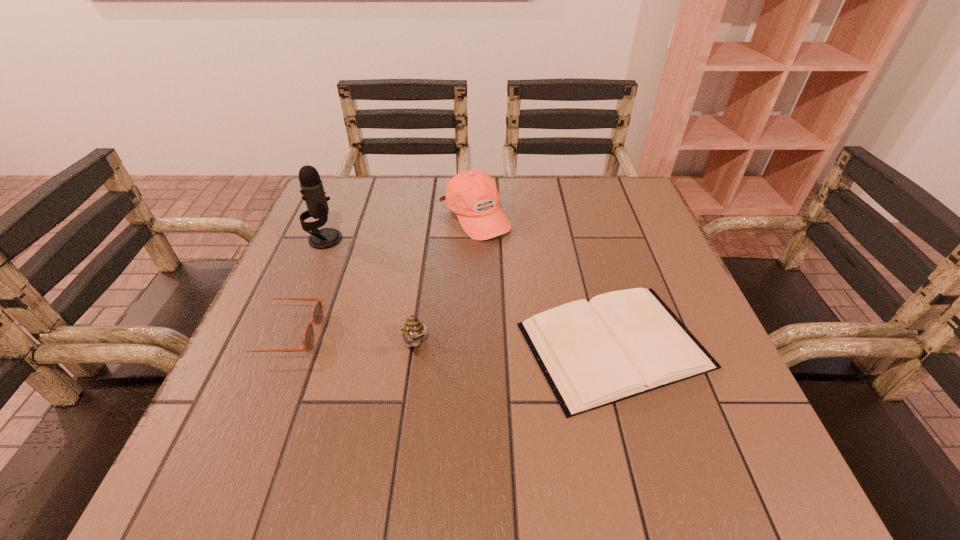
The width and height of the screenshot is (960, 540). I want to click on object that is the second nearest to the shortest object, so click(x=413, y=330).

Where is `object that stands as the closest to the fourth shortest object`? object that stands as the closest to the fourth shortest object is located at coordinates (620, 344).

Where is `vacant space that satisfies the following two spatial constraints: 1. on the front-facing side of the shortest object; 2. on the left side of the sunglasses`? The height and width of the screenshot is (540, 960). vacant space that satisfies the following two spatial constraints: 1. on the front-facing side of the shortest object; 2. on the left side of the sunglasses is located at coordinates tap(278, 346).

Locate an element on the screen. The width and height of the screenshot is (960, 540). free spot that satisfies the following two spatial constraints: 1. on the front side of the baseball cap; 2. on the front-facing side of the fourth tallest object is located at coordinates (472, 334).

The height and width of the screenshot is (540, 960). I want to click on vacant area in the image that satisfies the following two spatial constraints: 1. on the front side of the microphone; 2. on the front-facing side of the sunglasses, so click(x=286, y=334).

Where is `vacant region that satisfies the following two spatial constraints: 1. on the front side of the fourth shortest object; 2. on the front-facing side of the sunglasses`? The image size is (960, 540). vacant region that satisfies the following two spatial constraints: 1. on the front side of the fourth shortest object; 2. on the front-facing side of the sunglasses is located at coordinates (472, 334).

The height and width of the screenshot is (540, 960). I want to click on vacant point that satisfies the following two spatial constraints: 1. on the front side of the shortest object; 2. on the right side of the microphone, so click(x=281, y=346).